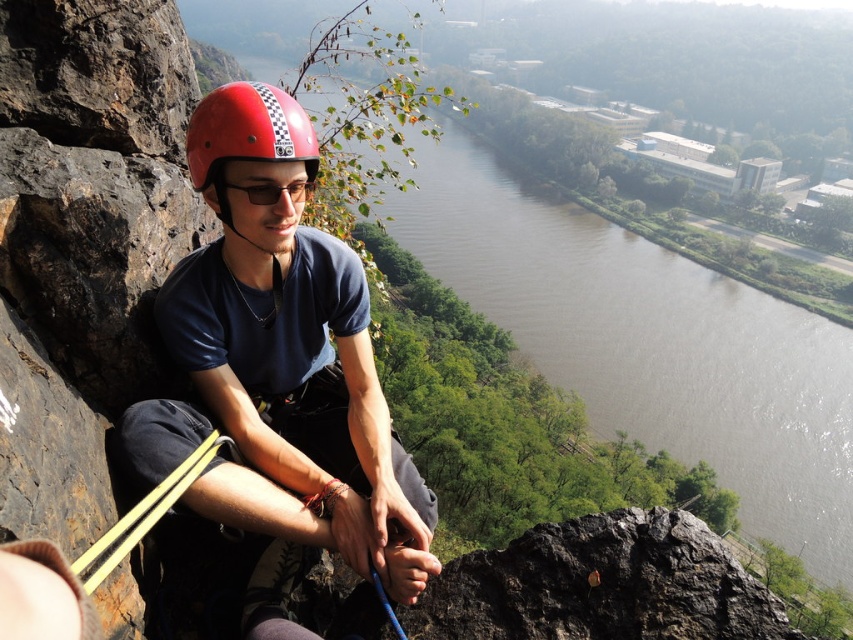
Question: Is matte red helmet at left positioned before matte red helmet at center?

Choices:
 (A) no
 (B) yes

Answer: (B)

Question: Which of the following is the closest to the observer?

Choices:
 (A) (271, 196)
 (B) (190, 154)
 (C) (262, 262)

Answer: (A)

Question: Can you confirm if brown water at center is bigger than matte red helmet at center?

Choices:
 (A) no
 (B) yes

Answer: (B)

Question: Which of these objects is positioned farthest from the brown water at center?

Choices:
 (A) matte red helmet at center
 (B) matte black goggles at center

Answer: (B)

Question: Which of the following is the farthest from the observer?

Choices:
 (A) (612, 342)
 (B) (260, 86)
 (C) (294, 186)
 (D) (289, 408)

Answer: (A)

Question: Is matte red helmet at left wider than matte black goggles at center?

Choices:
 (A) yes
 (B) no

Answer: (A)